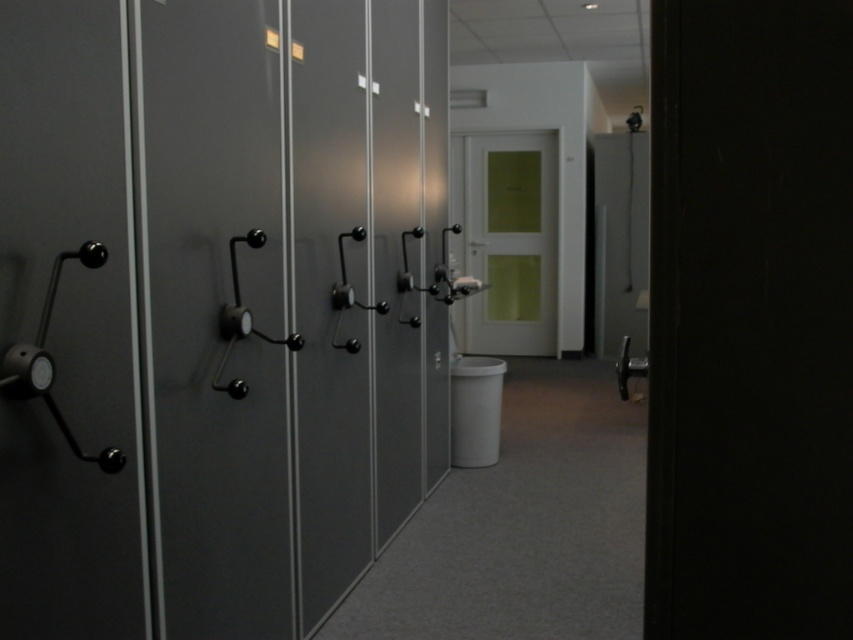
This screenshot has height=640, width=853. What do you see at coordinates (218, 314) in the screenshot?
I see `matte black door at left` at bounding box center [218, 314].

Who is more forward, (267, 244) or (117, 259)?

Positioned in front is point (117, 259).

Which is behind, point (169, 221) or point (62, 76)?

The point (169, 221) is behind.

The image size is (853, 640). What are the coordinates of `matte black door at left` in the screenshot? It's located at (218, 314).

Is metallic gray door at center to the left of matte green door at center from the viewer's perspective?

Indeed, metallic gray door at center is positioned on the left side of matte green door at center.

Between point (376, 182) and point (497, 307), which one is positioned behind?

Point (497, 307)

What do you see at coordinates (396, 259) in the screenshot? This screenshot has width=853, height=640. I see `metallic gray door at center` at bounding box center [396, 259].

In order to click on metallic gray door at center in this screenshot , I will do `click(396, 259)`.

Does matte black door at left have a lesser height compared to matte green door at center?

Yes.

Does point (184, 557) come behind point (521, 321)?

No, (184, 557) is closer to viewer.

This screenshot has height=640, width=853. What are the coordinates of `matte black door at left` in the screenshot? It's located at (218, 314).

Find the location of a particular element. The image size is (853, 640). matte black door at left is located at coordinates (218, 314).